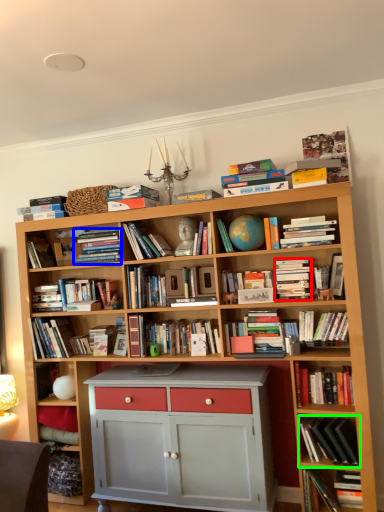
Question: Which is nearer to the paperback book (highlighted by a red box)? book (highlighted by a blue box) or book (highlighted by a green box).

Choices:
 (A) book
 (B) book

Answer: (B)